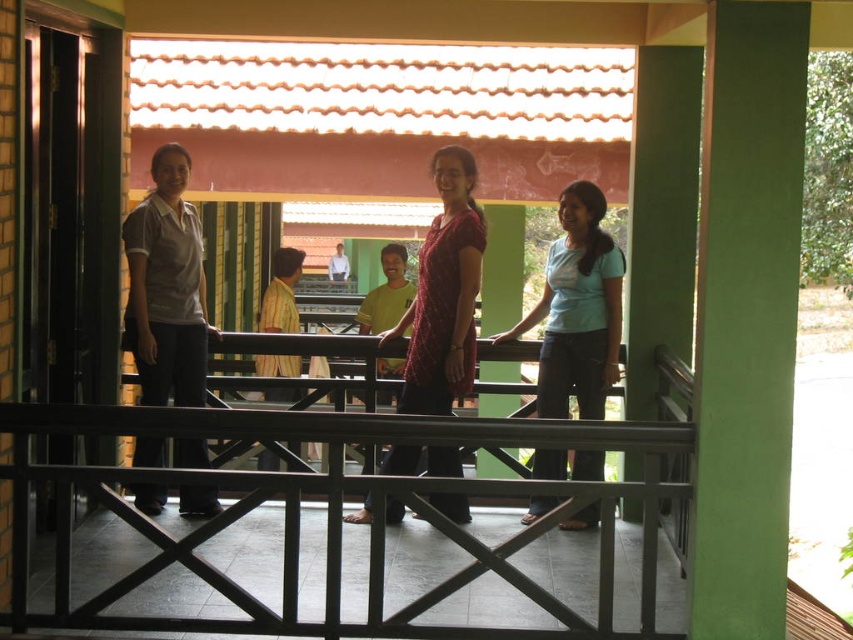
Question: Can you confirm if green matte pillar at right is bigger than light yellow shirt at center?

Choices:
 (A) no
 (B) yes

Answer: (B)

Question: Which of the following is the closest to the observer?

Choices:
 (A) metallic black balustrade at center
 (B) green matte pillar at right

Answer: (B)

Question: Can you confirm if yellow matte shirt at center is positioned above light yellow shirt at center?

Choices:
 (A) no
 (B) yes

Answer: (A)

Question: Which point is farther from the camera taking this photo?

Choices:
 (A) (431, 420)
 (B) (735, 378)
 (C) (392, 272)

Answer: (C)

Question: In this image, where is light blue fabric shirt at center located relative to light yellow shirt at center?

Choices:
 (A) right
 (B) left

Answer: (A)

Question: Estimate the real-world distances between objects in this image. Which object is farther from the light yellow shirt at center?

Choices:
 (A) maroon textured dress at center
 (B) metallic black balustrade at center

Answer: (B)